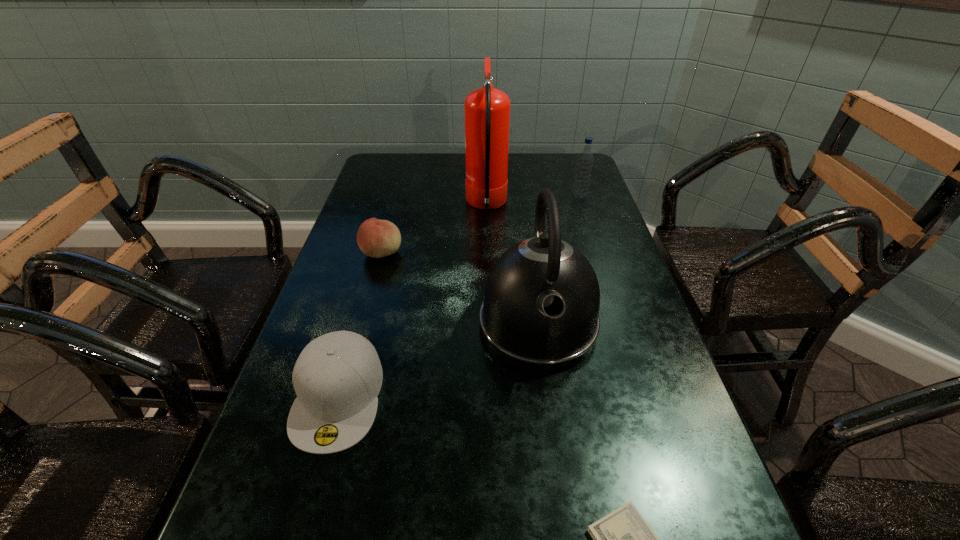
Image resolution: width=960 pixels, height=540 pixels. I want to click on vacant area that satisfies the following two spatial constraints: 1. towards the nozzle of the fire extinguisher; 2. on the front-facing side of the cap, so click(x=491, y=396).